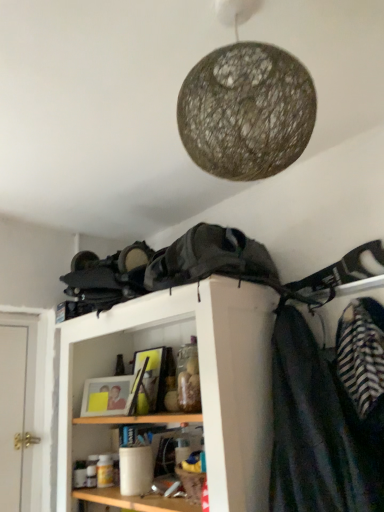
Question: Can you confirm if woven natural fiber lampshade at upper center is positioned to the left of striped fabric at right?

Choices:
 (A) yes
 (B) no

Answer: (A)

Question: Does woven natural fiber lampshade at upper center appear on the right side of striped fabric at right?

Choices:
 (A) no
 (B) yes

Answer: (A)

Question: From the image's perspective, is woven natural fiber lampshade at upper center beneath striped fabric at right?

Choices:
 (A) no
 (B) yes

Answer: (A)

Question: From the image's perspective, is woven natural fiber lampshade at upper center located above striped fabric at right?

Choices:
 (A) yes
 (B) no

Answer: (A)

Question: Is woven natural fiber lampshade at upper center completely or partially outside of striped fabric at right?

Choices:
 (A) yes
 (B) no

Answer: (A)

Question: Is striped fabric at right at the back of woven natural fiber lampshade at upper center?

Choices:
 (A) no
 (B) yes

Answer: (A)

Question: Is striped fabric at right completely or partially inside wooden shelf at center?

Choices:
 (A) no
 (B) yes

Answer: (A)

Question: Does wooden shelf at center have a greater height compared to striped fabric at right?

Choices:
 (A) no
 (B) yes

Answer: (B)

Question: Does wooden shelf at center have a greater width compared to striped fabric at right?

Choices:
 (A) yes
 (B) no

Answer: (A)

Question: Could you tell me if wooden shelf at center is turned towards striped fabric at right?

Choices:
 (A) yes
 (B) no

Answer: (B)

Question: From the image's perspective, does wooden shelf at center appear lower than striped fabric at right?

Choices:
 (A) yes
 (B) no

Answer: (A)

Question: From a real-world perspective, is wooden shelf at center below striped fabric at right?

Choices:
 (A) yes
 (B) no

Answer: (A)

Question: From the image's perspective, is wooden shelf at center beneath woven natural fiber lampshade at upper center?

Choices:
 (A) yes
 (B) no

Answer: (A)